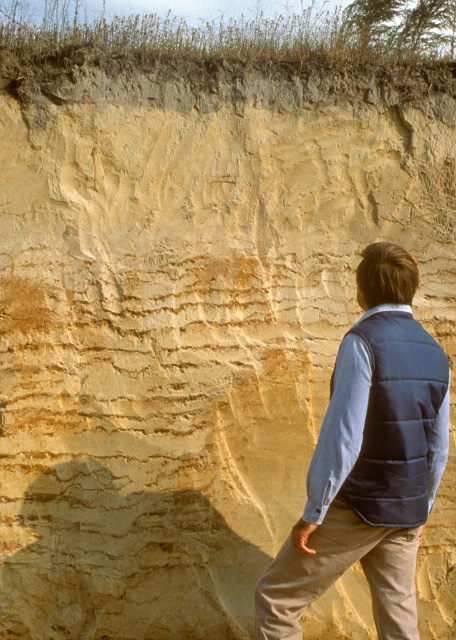
Question: Does blue quilted vest at center appear over dark blue quilted vest at center?

Choices:
 (A) no
 (B) yes

Answer: (A)

Question: Which point is closer to the camera taking this photo?

Choices:
 (A) (394, 333)
 (B) (322, 461)

Answer: (B)

Question: Considering the relative positions of blue quilted vest at center and dark blue quilted vest at center in the image provided, where is blue quilted vest at center located with respect to dark blue quilted vest at center?

Choices:
 (A) left
 (B) right

Answer: (A)

Question: Can you confirm if blue quilted vest at center is positioned to the right of dark blue quilted vest at center?

Choices:
 (A) yes
 (B) no

Answer: (B)